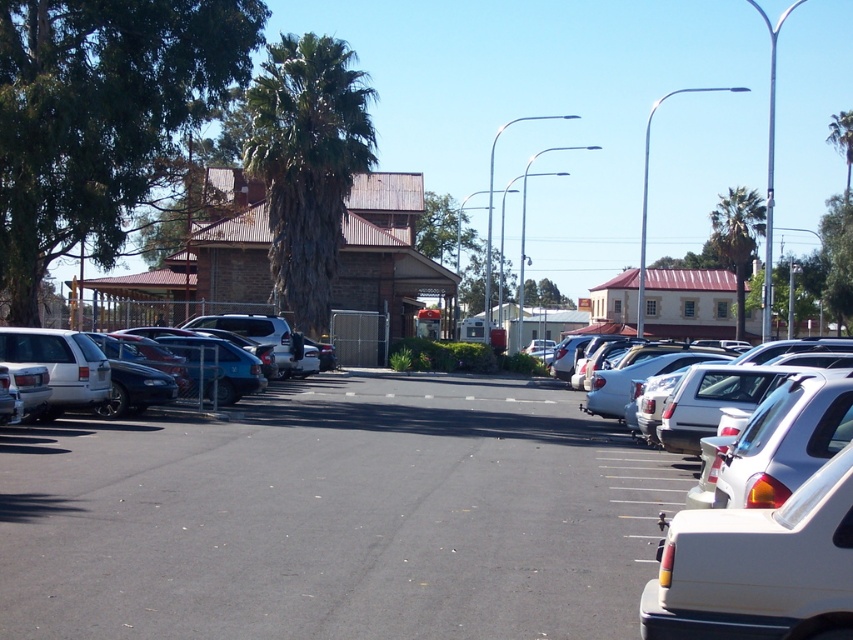
Is point (135, 616) closer to camera compared to point (746, 230)?

Yes.

Is white matte car at center bigger than green leafy palm tree at upper center?

No, white matte car at center is not bigger than green leafy palm tree at upper center.

This screenshot has height=640, width=853. What do you see at coordinates (335, 515) in the screenshot?
I see `white matte car at center` at bounding box center [335, 515].

Locate an element on the screen. The height and width of the screenshot is (640, 853). white matte car at center is located at coordinates (335, 515).

Does green leafy palm tree at center appear over white matte car at right?

Yes.

Is green leafy palm tree at center further to the viewer compared to white matte car at right?

That is True.

Who is more forward, (276, 138) or (762, 371)?

Answer: Point (762, 371)

Where is `green leafy palm tree at center`? green leafy palm tree at center is located at coordinates (306, 163).

Who is higher up, white matte car at center or matte black sedan at left?

Positioned higher is matte black sedan at left.

Does point (648, 576) come farther from viewer compared to point (206, 344)?

No, it is in front of (206, 344).

At what (x,y) coordinates should I click in order to perform the action: click on white matte car at center. Please return your answer as a coordinate pair (x, y). Looking at the image, I should click on click(x=335, y=515).